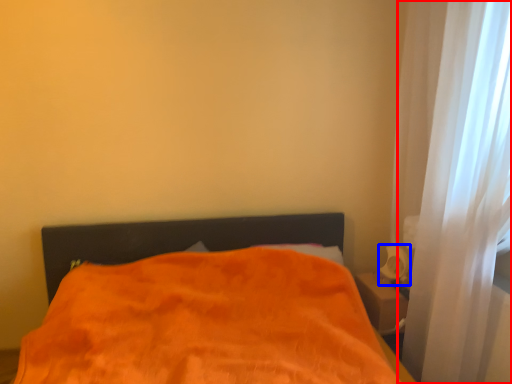
Question: Which of the following is the closest to the observer, curtain (highlighted by a red box) or table lamp (highlighted by a blue box)?

Choices:
 (A) curtain
 (B) table lamp

Answer: (A)